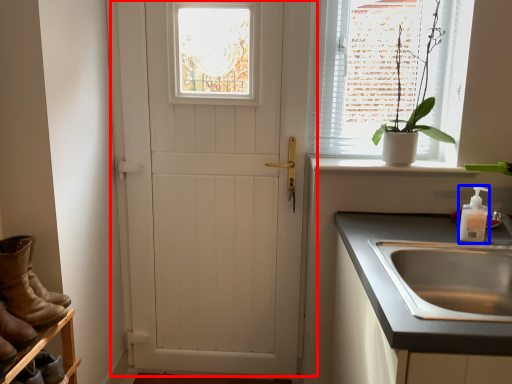
Question: Which object is closer to the camera taking this photo, door (highlighted by a red box) or soap dispenser (highlighted by a blue box)?

Choices:
 (A) door
 (B) soap dispenser

Answer: (B)